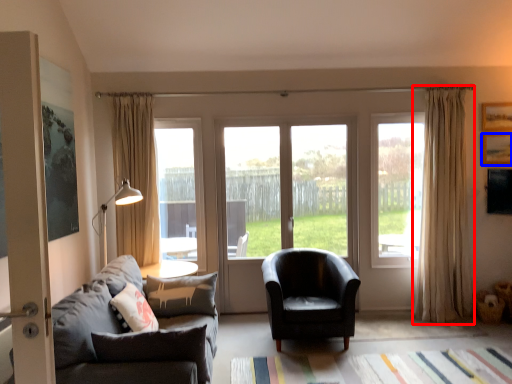
Question: Which point is closer to the camera, curtain (highlighted by a red box) or picture frame (highlighted by a blue box)?

Choices:
 (A) curtain
 (B) picture frame

Answer: (A)